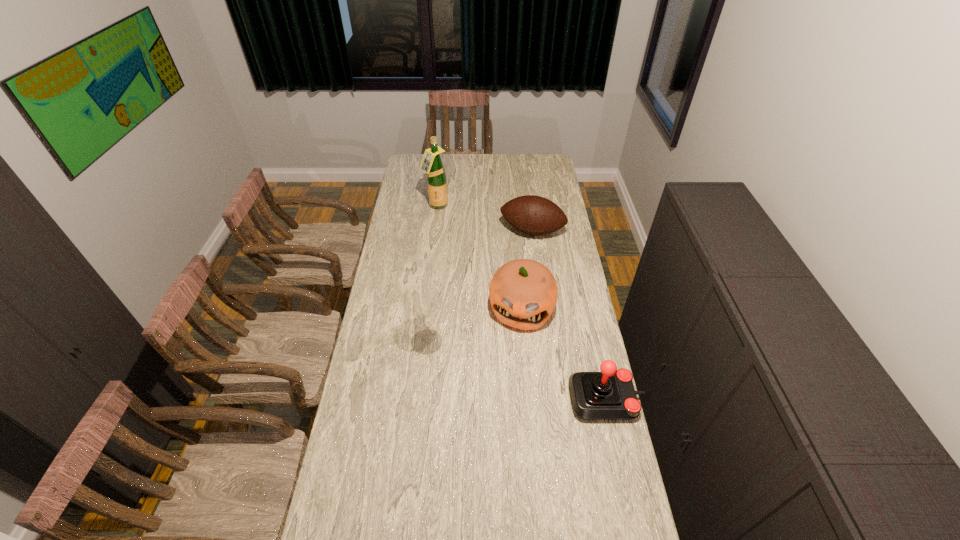
Locate an element on the screen. The width and height of the screenshot is (960, 540). vacant region at the far edge is located at coordinates (444, 166).

Where is `free space at the near edge of the desktop`? The image size is (960, 540). free space at the near edge of the desktop is located at coordinates (404, 510).

At what (x,y) coordinates should I click in order to perform the action: click on vacant area at the left edge. Please return your answer as a coordinate pair (x, y). Looking at the image, I should click on (368, 349).

Find the location of `vacant space at the right edge`. vacant space at the right edge is located at coordinates (573, 295).

Locate an element on the screen. This screenshot has height=540, width=960. vacant region at the far right corner is located at coordinates coord(537,160).

You are a GUI agent. You are given a task and a screenshot of the screen. Output one action in this format:
    pyautogui.click(x=<x>, y=<y>)
    Task: Click on the free point between the pumpkin and the tallest object
    This screenshot has width=960, height=540.
    Given the screenshot: What is the action you would take?
    pyautogui.click(x=479, y=257)

Locate an element on the screen. empty space that is in between the liquor and the pumpkin is located at coordinates (479, 257).

You are a GUI agent. You are given a task and a screenshot of the screen. Output one action in this format:
    pyautogui.click(x=<x>, y=<y>)
    Task: Click on the free space between the flute glass and the pumpkin
    
    Given the screenshot: What is the action you would take?
    pyautogui.click(x=474, y=325)

You are a GUI agent. You are given a task and a screenshot of the screen. Output one action in this format:
    pyautogui.click(x=<x>, y=<y>)
    Task: Click on the unoccupied position between the flute glass and the pumpkin
    
    Given the screenshot: What is the action you would take?
    pyautogui.click(x=474, y=325)

Where is `vacant space in between the flute glass and the football`? This screenshot has width=960, height=540. vacant space in between the flute glass and the football is located at coordinates (479, 286).